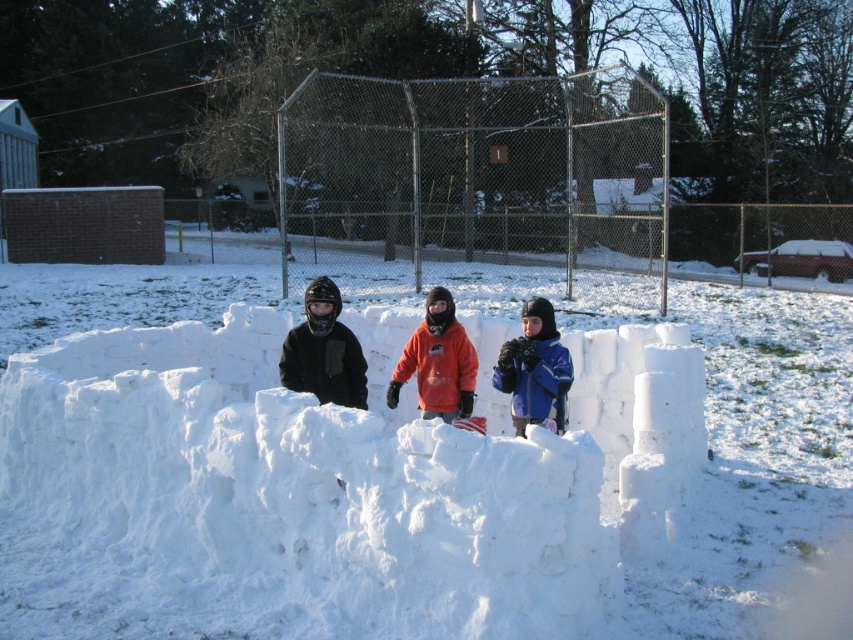
This screenshot has height=640, width=853. Find the location of `white fluffy snow at center`. white fluffy snow at center is located at coordinates (195, 472).

Does white fluffy snow at center have a greater width compared to matte black jacket at center?

Yes, white fluffy snow at center is wider than matte black jacket at center.

This screenshot has height=640, width=853. I want to click on white fluffy snow at center, so click(195, 472).

Locate an element on the screen. The image size is (853, 640). white fluffy snow at center is located at coordinates (195, 472).

Does matte black jacket at center have a greater width compared to orange fleece jacket at center?

No, matte black jacket at center is not wider than orange fleece jacket at center.

You are a GUI agent. You are given a task and a screenshot of the screen. Output one action in this format:
    pyautogui.click(x=<x>, y=<y>)
    Task: Click on the matte black jacket at center
    
    Given the screenshot: What is the action you would take?
    pyautogui.click(x=323, y=352)

Between white fluffy snow at center and orange fleece jacket at center, which one appears on the right side from the viewer's perspective?

white fluffy snow at center

Can you confirm if white fluffy snow at center is positioned to the left of orange fleece jacket at center?

In fact, white fluffy snow at center is to the right of orange fleece jacket at center.

Is point (316, 461) behind point (462, 342)?

No, (316, 461) is in front of (462, 342).

The height and width of the screenshot is (640, 853). Find the location of `white fluffy snow at center`. white fluffy snow at center is located at coordinates (195, 472).